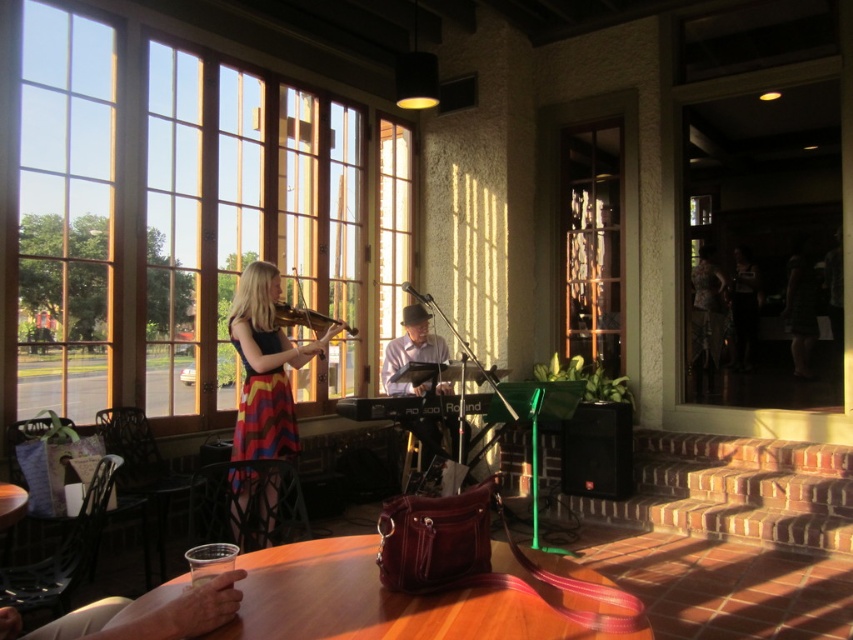
Is the position of multicolored fabric dress at center less distant than that of wooden violin at center?

Yes, it is.

Does multicolored fabric dress at center lie behind wooden violin at center?

No, it is in front of wooden violin at center.

Which is in front, point (253, 330) or point (326, 326)?

Point (253, 330) is in front.

I want to click on multicolored fabric dress at center, so click(x=265, y=368).

Can you confirm if wooden table at lower center is thinner than clear glass window at center?

Incorrect, wooden table at lower center's width is not less than clear glass window at center's.

Can you confirm if wooden table at lower center is shorter than clear glass window at center?

Correct, wooden table at lower center is not as tall as clear glass window at center.

Between point (241, 625) and point (538, 280), which one is positioned in front?

Positioned in front is point (241, 625).

The width and height of the screenshot is (853, 640). I want to click on wooden table at lower center, so click(419, 600).

Is point (234, 198) closer to camera compared to point (247, 497)?

That is False.

Does clear glass window at left have a lesser width compared to multicolored fabric dress at center?

Incorrect, clear glass window at left's width is not less than multicolored fabric dress at center's.

You are a GUI agent. You are given a task and a screenshot of the screen. Output one action in this format:
    pyautogui.click(x=<x>, y=<y>)
    Task: Click on the clear glass window at left
    The width and height of the screenshot is (853, 640).
    Given the screenshot: What is the action you would take?
    pyautogui.click(x=183, y=216)

Where is `clear glass window at left`? Image resolution: width=853 pixels, height=640 pixels. clear glass window at left is located at coordinates (183, 216).